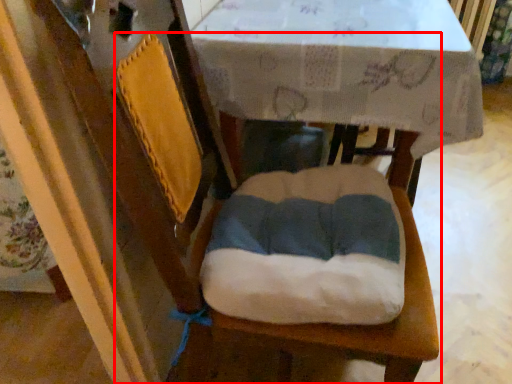
Question: From the image's perspective, considering the relative positions of chair (annotated by the red box) and round table in the image provided, where is chair (annotated by the red box) located with respect to the staircase?

Choices:
 (A) above
 (B) below

Answer: (B)